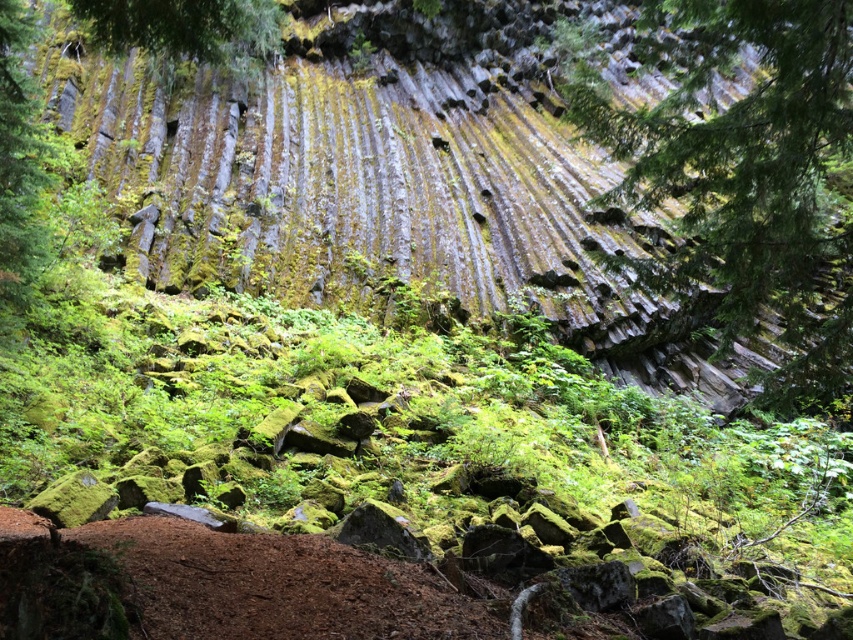
Question: Can you confirm if green mossy rock at upper right is wider than green leafy tree at upper center?

Choices:
 (A) no
 (B) yes

Answer: (B)

Question: Is green mossy rock at upper right smaller than green leafy tree at upper center?

Choices:
 (A) no
 (B) yes

Answer: (A)

Question: Does green mossy rock at upper right have a greater width compared to green leafy tree at upper center?

Choices:
 (A) no
 (B) yes

Answer: (B)